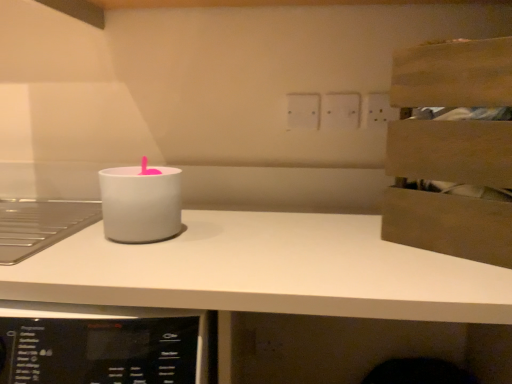
Identify the location of vacant area situated to the left side of wooden crate at upper right. The width and height of the screenshot is (512, 384). coord(325,241).